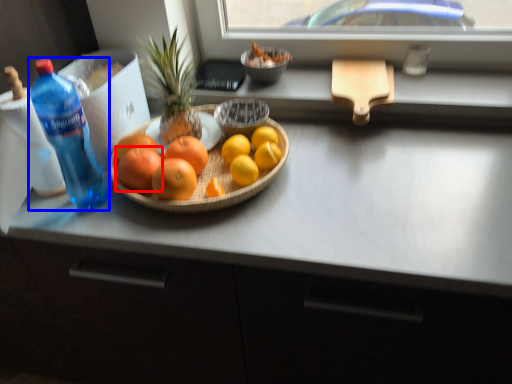
Question: Among these objects, which one is farthest to the camera, grapefruit (highlighted by a red box) or bottle (highlighted by a blue box)?

Choices:
 (A) grapefruit
 (B) bottle

Answer: (A)